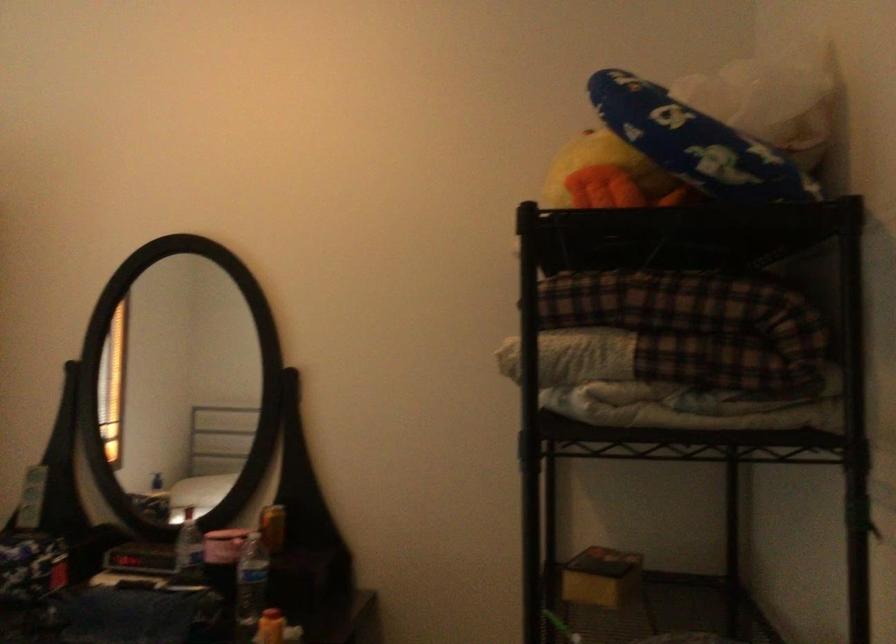
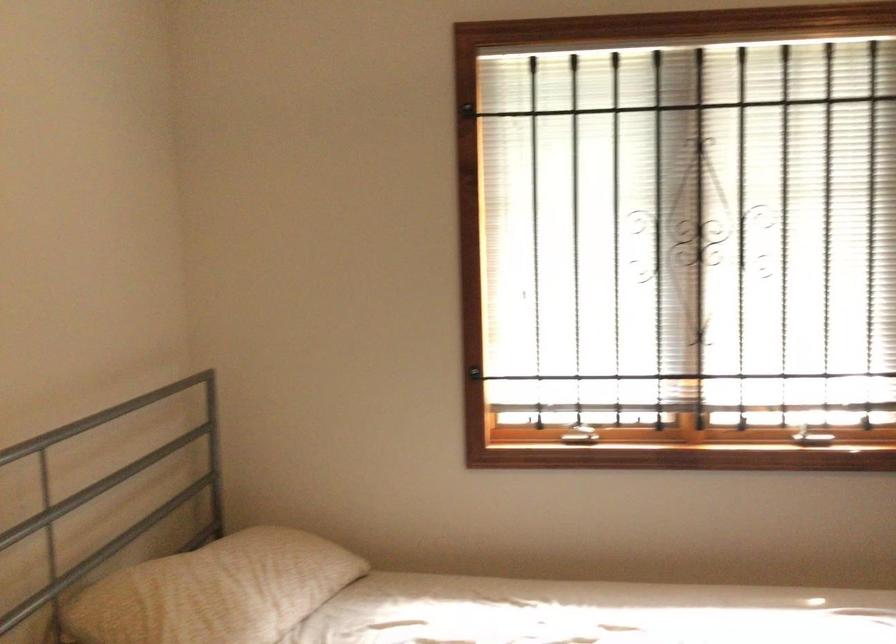
Question: The images are taken continuously from a first-person perspective. In which direction is your viewpoint rotating?

Choices:
 (A) Left
 (B) Right
 (C) Up
 (D) Down

Answer: (A)